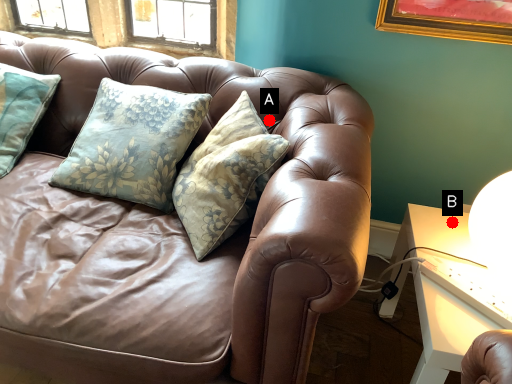
Question: Two points are circled on the image, labeled by A and B beside each circle. Which point is further to the camera?

Choices:
 (A) A is further
 (B) B is further

Answer: (A)